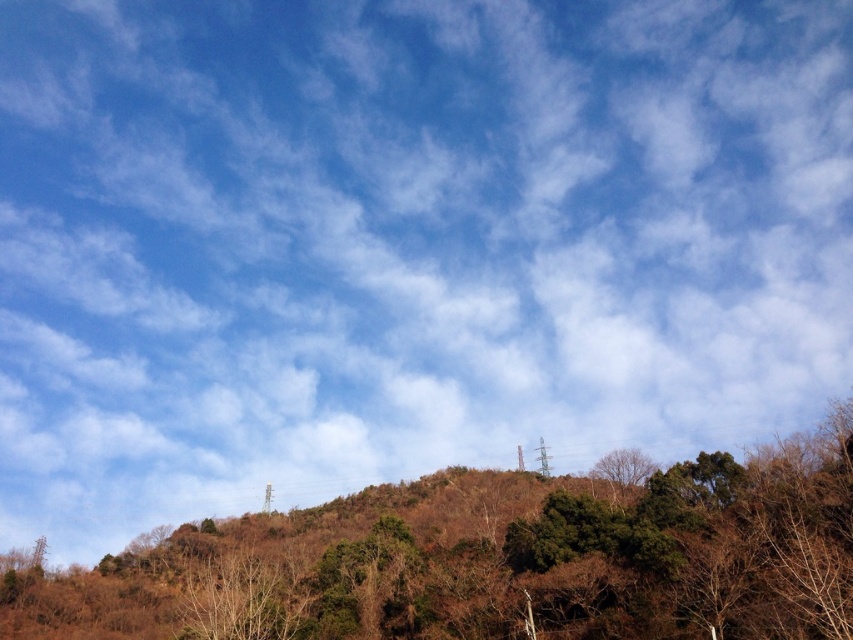
Question: Is brown/dry wood at center to the left of bare branches at center from the viewer's perspective?

Choices:
 (A) yes
 (B) no

Answer: (A)

Question: Which point is closer to the camera?

Choices:
 (A) bare branches at center
 (B) brown/dry wood at center

Answer: (B)

Question: Is brown/dry wood at center smaller than bare branches at center?

Choices:
 (A) no
 (B) yes

Answer: (A)

Question: Which point is farther to the camera?

Choices:
 (A) (618, 468)
 (B) (271, 630)

Answer: (A)

Question: Can you confirm if brown/dry wood at center is bigger than bare branches at center?

Choices:
 (A) yes
 (B) no

Answer: (A)